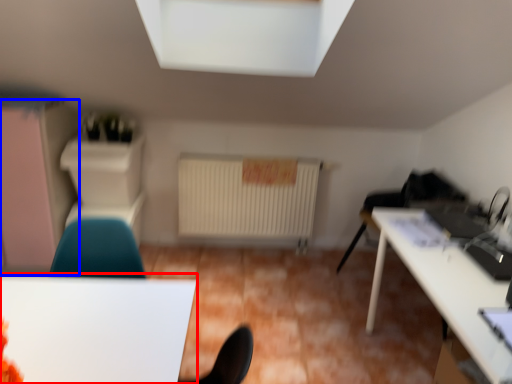
Question: Which object appears closest to the camera in this image, table (highlighted by a red box) or dresser (highlighted by a blue box)?

Choices:
 (A) table
 (B) dresser

Answer: (A)